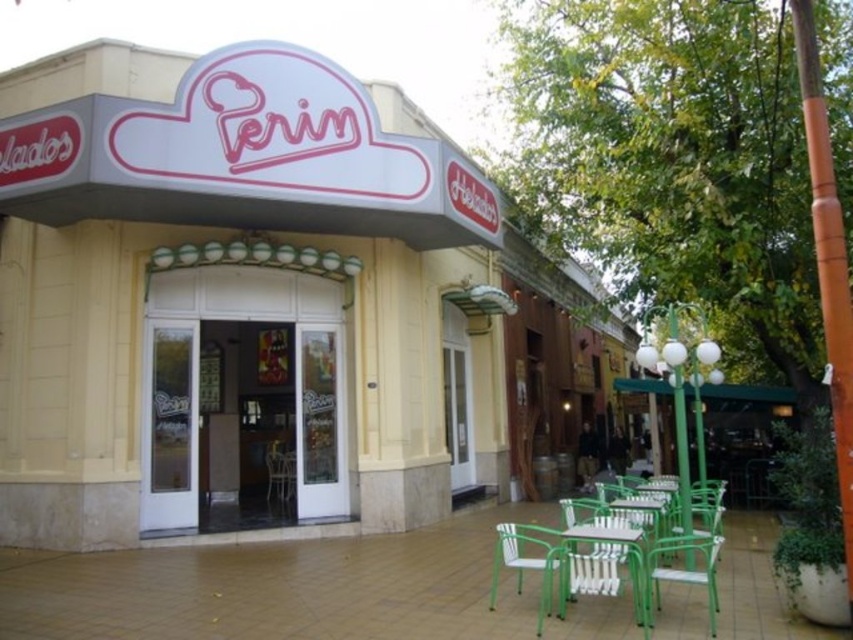
Question: From the image, what is the correct spatial relationship of green plastic chair at lower center in relation to green plastic chair at lower right?

Choices:
 (A) left
 (B) right

Answer: (A)

Question: Which of the following is the closest to the observer?

Choices:
 (A) green plastic table at center
 (B) green plastic chair at lower right

Answer: (A)

Question: Which is farther from the green plastic chair at lower right?

Choices:
 (A) green plastic table at center
 (B) green plastic chair at lower center
 (C) green metal chair at lower right

Answer: (B)

Question: Based on their relative distances, which object is farther from the green metal chair at lower right?

Choices:
 (A) green plastic table at center
 (B) green plastic chair at lower right
 (C) green plastic chair at lower center
 (D) white plastic chair at center

Answer: (D)

Question: Is green metal chair at lower right bigger than green plastic table at center?

Choices:
 (A) no
 (B) yes

Answer: (B)

Question: Can you confirm if green metal chair at lower right is smaller than green plastic chair at lower center?

Choices:
 (A) yes
 (B) no

Answer: (B)